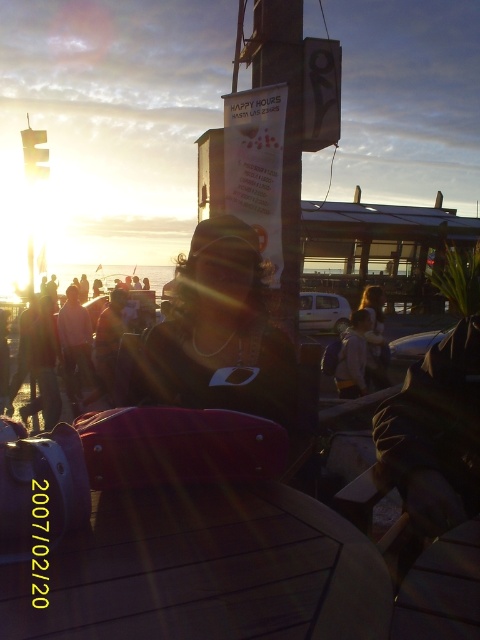
Does wooden table at center have a greater width compared to light brown leather jacket at center?

Yes.

Which is in front, point (215, 536) or point (362, 369)?

Positioned in front is point (215, 536).

Where is `wooden table at center`? The width and height of the screenshot is (480, 640). wooden table at center is located at coordinates (205, 570).

Is white paper sign at center taller than light brown leather jacket at center?

Yes, white paper sign at center is taller than light brown leather jacket at center.

Who is lower down, white paper sign at center or light brown leather jacket at center?

light brown leather jacket at center is below.

Which is in front, point (285, 156) or point (355, 365)?

Point (285, 156)

Identify the location of white paper sign at center. (284, 134).

Between wooden table at center and white paper sign at center, which one is positioned higher?

white paper sign at center is higher up.

Between wooden table at center and white paper sign at center, which one is positioned lower?

Positioned lower is wooden table at center.

Between point (70, 564) and point (291, 182), which one is positioned behind?

Point (291, 182)

The image size is (480, 640). Identify the location of wooden table at center. (205, 570).